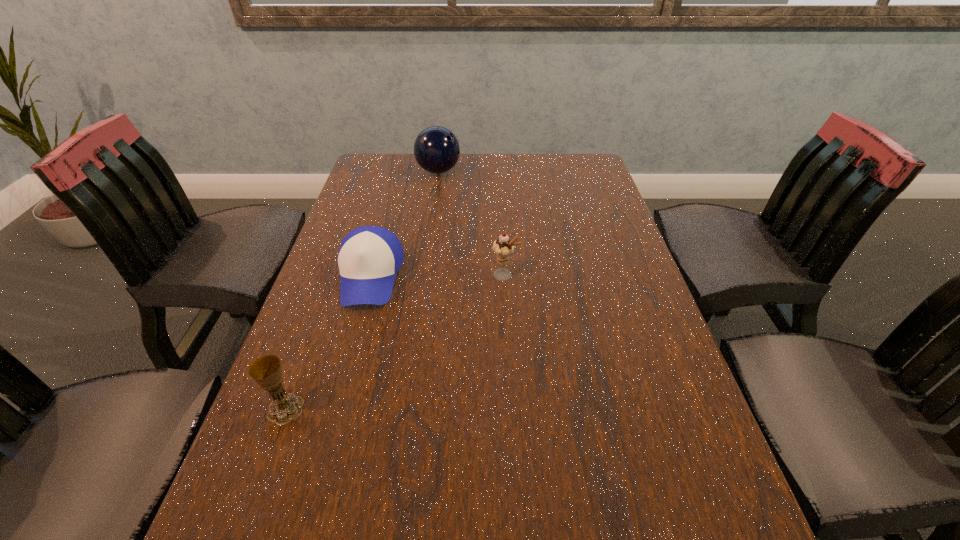
Where is `vacant position in the image that satisfies the following two spatial constraints: 1. on the surface of the farthest object near the finger holes; 2. on the front-facing side of the baseball cap`? vacant position in the image that satisfies the following two spatial constraints: 1. on the surface of the farthest object near the finger holes; 2. on the front-facing side of the baseball cap is located at coordinates (423, 276).

Locate an element on the screen. The image size is (960, 540). free spot that satisfies the following two spatial constraints: 1. on the surface of the farthest object near the finger holes; 2. on the front-facing side of the shortest object is located at coordinates (423, 276).

The width and height of the screenshot is (960, 540). What are the coordinates of `vacant point that satisfies the following two spatial constraints: 1. on the surface of the farthest object near the finger holes; 2. on the left side of the rightmost object` in the screenshot? It's located at (423, 275).